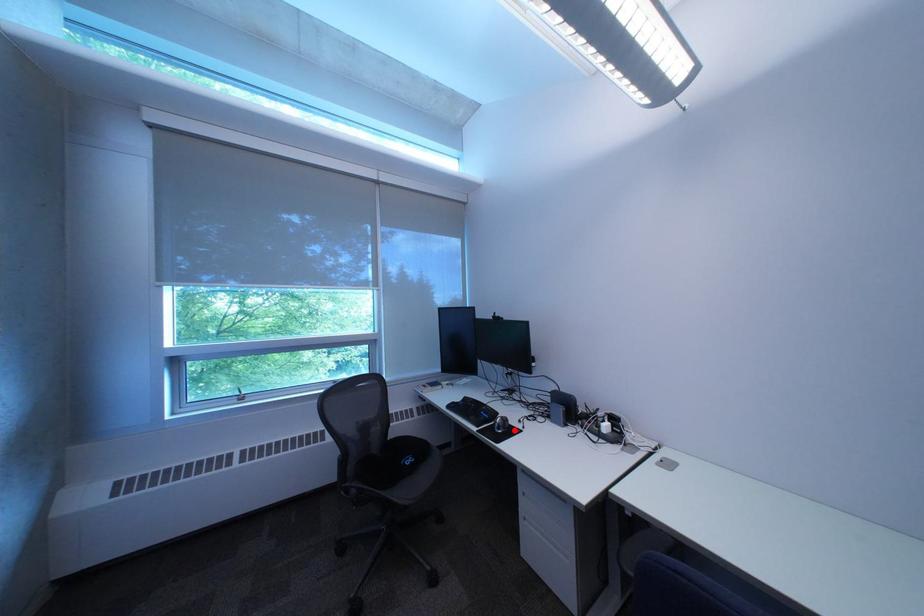
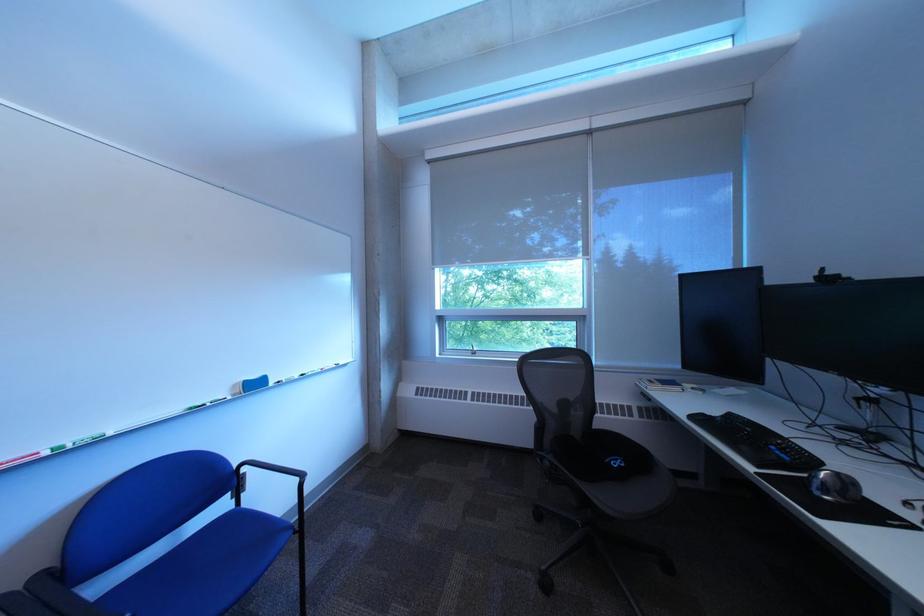
Locate, in the second image, the point that corresponds to the highlighted location in the first image.

(841, 493)